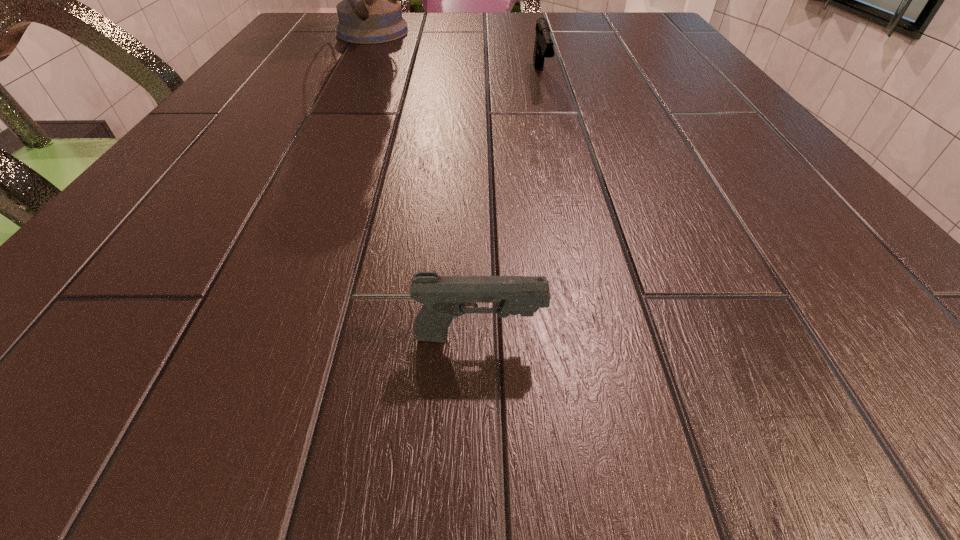
Locate an element on the screen. object that is the closest to the nearer pistol is located at coordinates (543, 47).

Locate an element on the screen. This screenshot has width=960, height=540. free point that satisfies the following two spatial constraints: 1. on the front-facing side of the right pistol; 2. at the barrel of the nearest object is located at coordinates (602, 336).

Find the location of a particular element. The image size is (960, 540). vacant region that satisfies the following two spatial constraints: 1. on the front-facing side of the right pistol; 2. at the barrel of the nearest object is located at coordinates (602, 336).